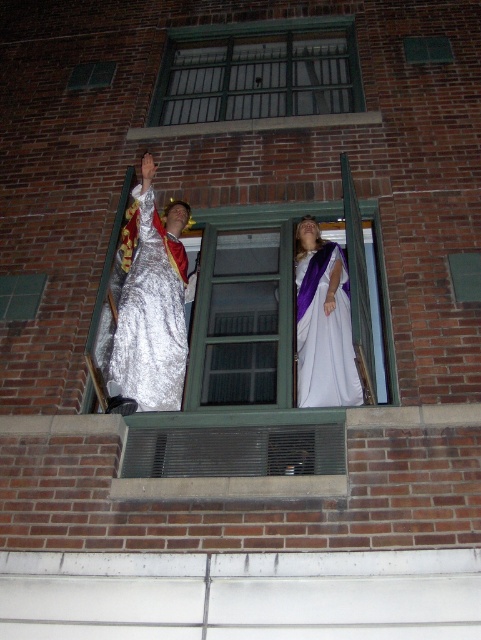
Question: Which is nearer to the clear glass window at center?

Choices:
 (A) white satin dress at center
 (B) shiny silver gown at left
 (C) green metal bars at upper center

Answer: (A)

Question: Which point is farther from the camera taking this photo?

Choices:
 (A) (141, 188)
 (B) (354, 400)
 (C) (319, 99)
 (D) (262, 339)

Answer: (C)

Question: Is the position of clear glass window at center more distant than that of white satin dress at center?

Choices:
 (A) yes
 (B) no

Answer: (B)

Question: Which object is closer to the camera taking this photo?

Choices:
 (A) clear glass window at center
 (B) shiny silver gown at left
 (C) green metal bars at upper center
 (D) white satin dress at center

Answer: (B)

Question: Is shiny silver gown at left below white satin dress at center?

Choices:
 (A) no
 (B) yes

Answer: (A)

Question: Is shiny silver gown at left to the left of white satin dress at center from the viewer's perspective?

Choices:
 (A) yes
 (B) no

Answer: (A)